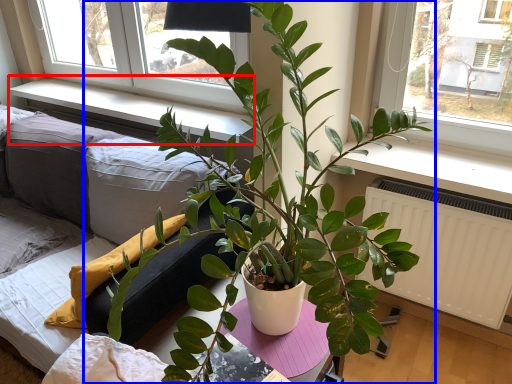
Question: Which of the following is the closest to the observer, window sill (highlighted by a red box) or houseplant (highlighted by a blue box)?

Choices:
 (A) window sill
 (B) houseplant

Answer: (B)